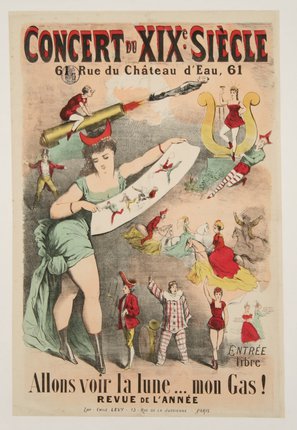
Identify the location of harp. The height and width of the screenshot is (430, 297). (208, 109), (247, 109).